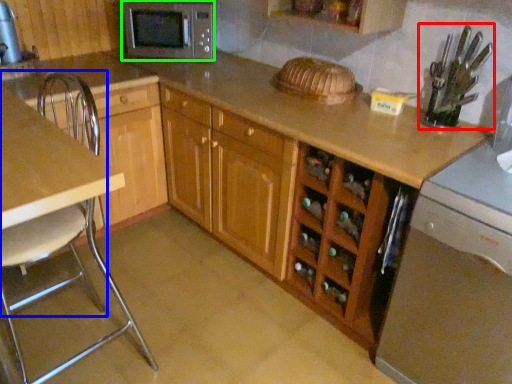
Question: Which object is the farthest from appliance (highlighted by a red box)? Choose among these: chair (highlighted by a blue box) or microwave oven (highlighted by a green box).

Choices:
 (A) chair
 (B) microwave oven

Answer: (A)